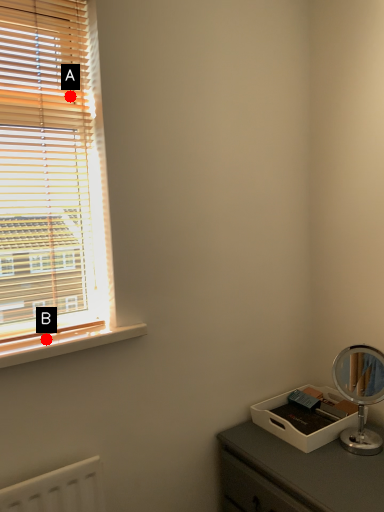
Question: Two points are circled on the image, labeled by A and B beside each circle. Among these points, which one is nearest to the camera?

Choices:
 (A) A is closer
 (B) B is closer

Answer: (A)